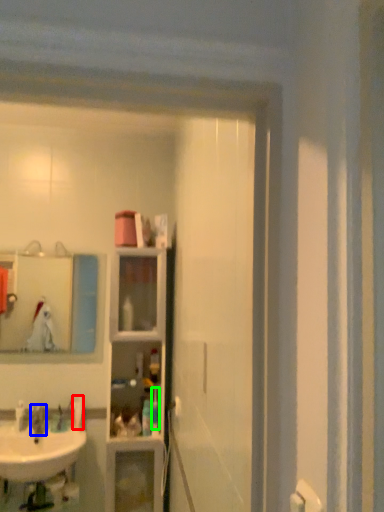
Question: Considering the real-world distances, which object is farthest from toiletry (highlighted by a red box)? faucet (highlighted by a blue box) or toiletry (highlighted by a green box)?

Choices:
 (A) faucet
 (B) toiletry

Answer: (B)